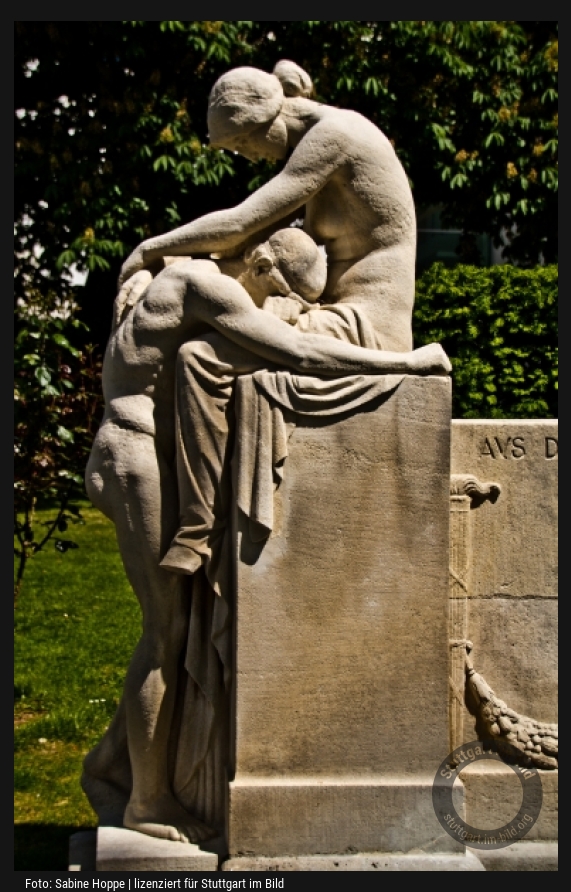
Where is `plinth`? plinth is located at coordinates (335, 575).